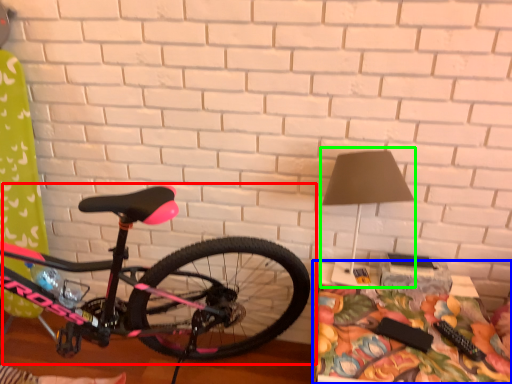
Question: Which object is positioned closest to bicycle (highlighted by a red box)? Select from table (highlighted by a blue box) and table lamp (highlighted by a green box).

Choices:
 (A) table
 (B) table lamp

Answer: (A)